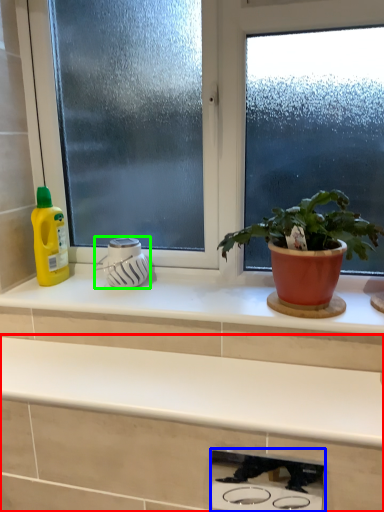
Question: Based on their relative distances, which object is farther from countertop (highlighted by a red box)? Choose from appliance (highlighted by a blue box) and appliance (highlighted by a green box).

Choices:
 (A) appliance
 (B) appliance

Answer: (A)